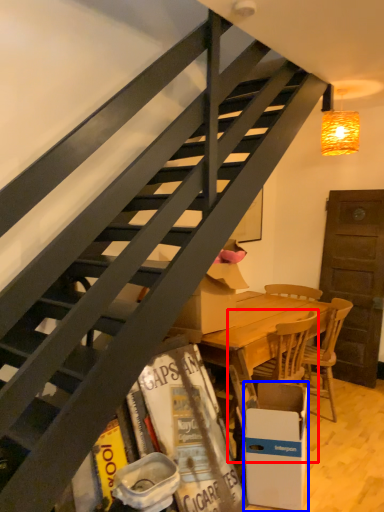
Question: Which object is closer to the camera taking this photo, chair (highlighted by a red box) or box (highlighted by a blue box)?

Choices:
 (A) chair
 (B) box

Answer: (B)